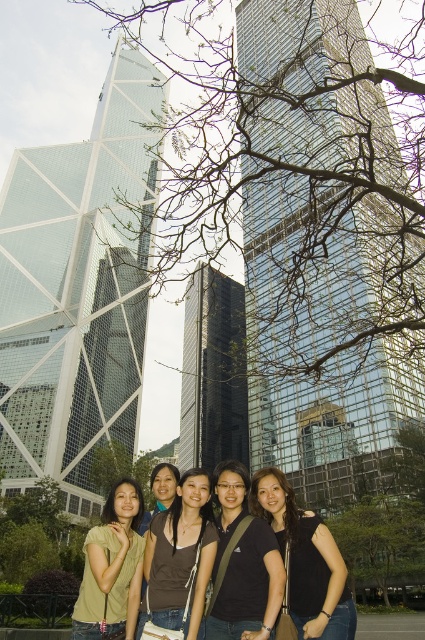
You are a photographer trying to adjust the lighting for a group photo. You notice two shirts at the center of the image, a black matte shirt at center and a brown fabric shirt at center. Which shirt is positioned to the right of the other?

The black matte shirt at center is to the right of the brown fabric shirt at center.

You are a photographer trying to adjust the focus of your camera. You need to focus on the person wearing the black matte shirt at center and the brown fabric shirt at center. Which shirt should you focus on first if you want to ensure both are in focus, considering their sizes?

The black matte shirt at center is smaller than the brown fabric shirt at center, so you should focus on the brown fabric shirt at center first because it is larger and might require more precise focusing to capture details.